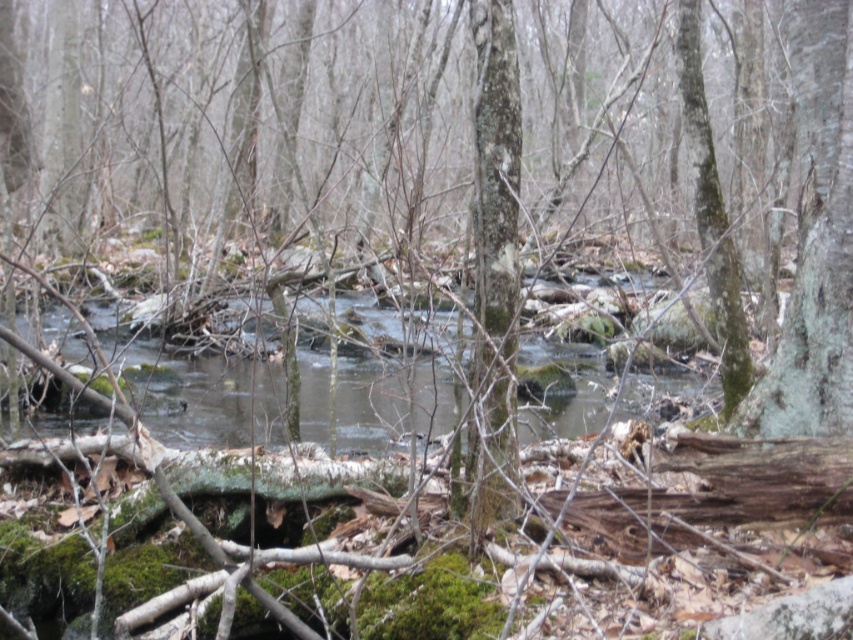
Question: Can you confirm if green mossy bark tree trunk at center is positioned below clear water at center?

Choices:
 (A) yes
 (B) no

Answer: (B)

Question: Does green mossy bark tree trunk at center have a greater width compared to clear water at center?

Choices:
 (A) yes
 (B) no

Answer: (B)

Question: Can you confirm if green mossy bark tree trunk at center is positioned above clear water at center?

Choices:
 (A) no
 (B) yes

Answer: (B)

Question: Which object is closer to the camera taking this photo?

Choices:
 (A) green mossy bark tree trunk at center
 (B) clear water at center

Answer: (A)

Question: Which of the following is the closest to the observer?

Choices:
 (A) (202, 403)
 (B) (515, 122)

Answer: (B)

Question: Which point is farther from the camera taking this photo?

Choices:
 (A) (503, 26)
 (B) (339, 412)

Answer: (B)